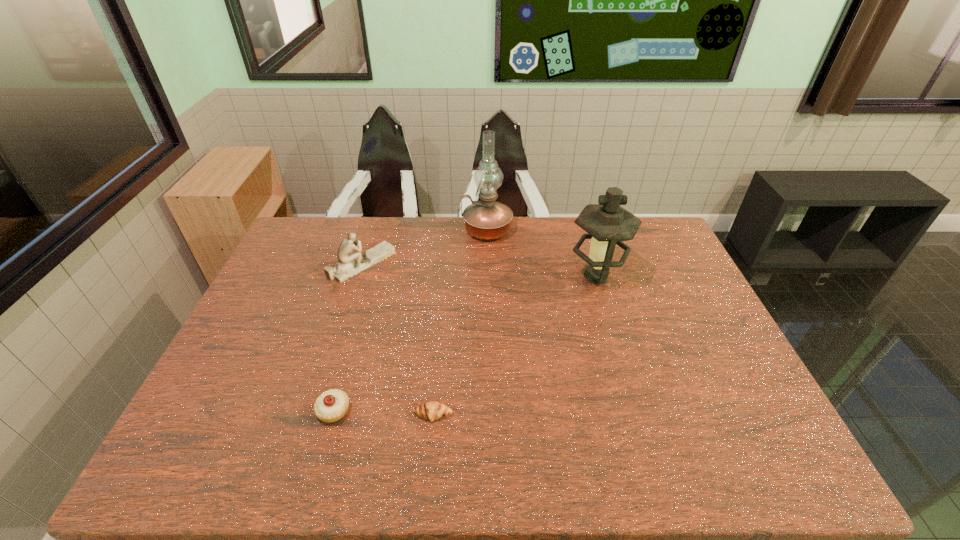
The height and width of the screenshot is (540, 960). I want to click on the tallest object, so click(486, 219).

Identify the location of the left oil lamp. (486, 219).

This screenshot has height=540, width=960. Find the location of `the right oil lamp`. the right oil lamp is located at coordinates (607, 223).

Find the location of `the shorter oil lamp`. the shorter oil lamp is located at coordinates (607, 223).

The image size is (960, 540). Find the location of `figurine`. figurine is located at coordinates (350, 262).

Image resolution: width=960 pixels, height=540 pixels. I want to click on the fourth tallest object, so click(331, 406).

Locate an element on the screen. the left pastry is located at coordinates point(331,406).

This screenshot has height=540, width=960. I want to click on the shorter pastry, so click(x=433, y=410).

This screenshot has width=960, height=540. I want to click on the right pastry, so click(433, 410).

The height and width of the screenshot is (540, 960). I want to click on free space located on the front of the farther oil lamp, so click(488, 270).